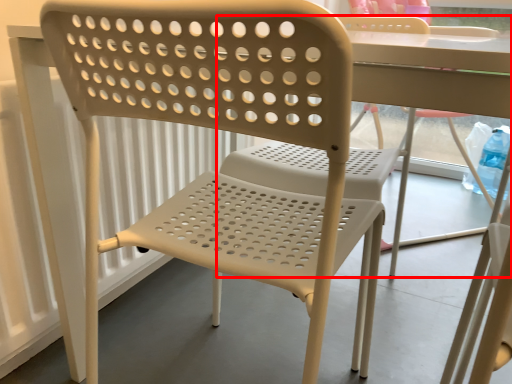
Question: From the image's perspective, where is chair (annotated by the red box) located relative to chair?

Choices:
 (A) above
 (B) below

Answer: (A)